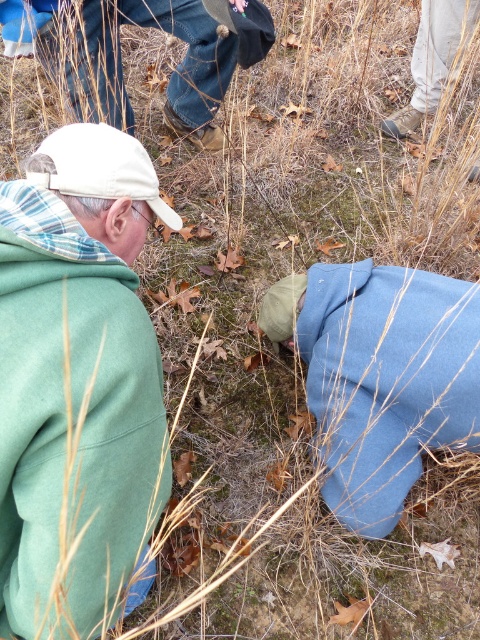
You are standing at point (252, 38) and want to walk to point (406, 488). Based on the scene description, will you have to walk towards or away from the two people crouched in the foreground?

You will have to walk towards the two people crouched in the foreground because point (406, 488) is in front of point (252, 38), meaning it is closer to the camera and the people are located in the foreground.

You are trying to determine which object takes up more area in the image. The blue fleece jacket at lower right and the brown leather boots at upper center are both visible. Based on their positions, which one do you think covers a larger portion of the image?

The brown leather boots at upper center occupy more space in the image than the blue fleece jacket at lower right according to the description.